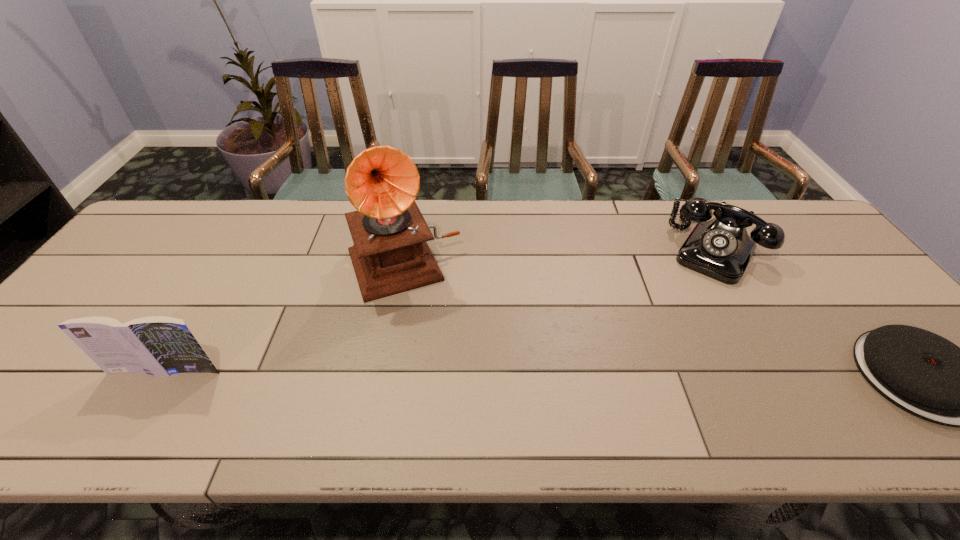
Where is `vacant region between the book and the telephone`? vacant region between the book and the telephone is located at coordinates (441, 309).

Where is `vacant area that lies between the second shortest object and the book`? The height and width of the screenshot is (540, 960). vacant area that lies between the second shortest object and the book is located at coordinates (441, 309).

The height and width of the screenshot is (540, 960). Find the location of `free spot between the third tallest object and the second tallest object`. free spot between the third tallest object and the second tallest object is located at coordinates (441, 309).

You are a GUI agent. You are given a task and a screenshot of the screen. Output one action in this format:
    pyautogui.click(x=<x>, y=<y>)
    Task: Click on the object that can be found as the closest to the third shortest object
    The height and width of the screenshot is (540, 960).
    Given the screenshot: What is the action you would take?
    pyautogui.click(x=390, y=255)

Locate which object is the second closest to the book. Please provide its 2D coordinates. Your answer should be formatted as a tuple, i.e. [(x, y)], where the tuple contains the x and y coordinates of a point satisfying the conditions above.

[(720, 248)]